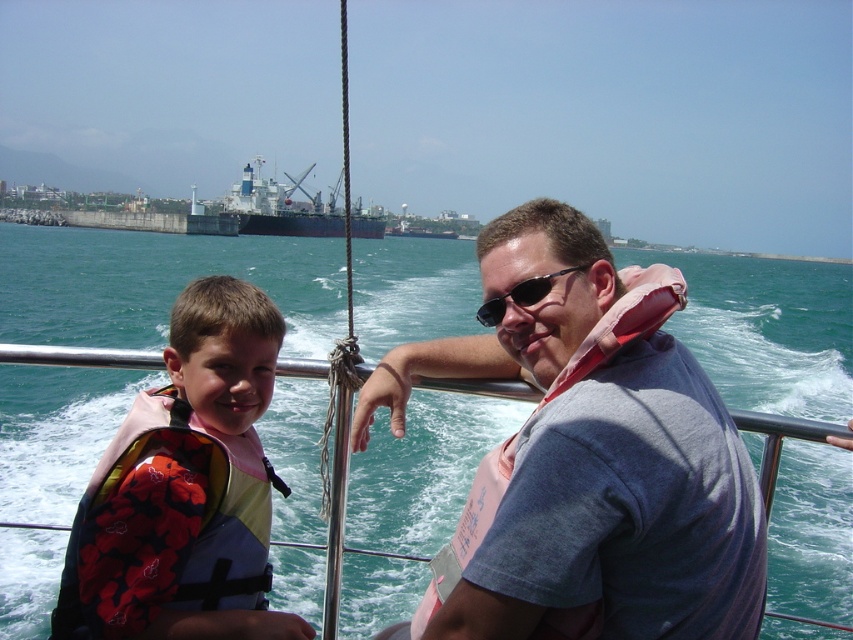
Does gray fabric life vest at right have a larger size compared to dark blue matte ship at center?

No, gray fabric life vest at right is not bigger than dark blue matte ship at center.

Does gray fabric life vest at right have a lesser height compared to dark blue matte ship at center?

Yes.

Find the location of a particular element. The width and height of the screenshot is (853, 640). gray fabric life vest at right is located at coordinates (590, 458).

Is dark blue matte ship at center above sunglasses at center?

Indeed, dark blue matte ship at center is positioned over sunglasses at center.

Between point (265, 204) and point (491, 323), which one is positioned in front?

Point (491, 323) is in front.

Locate an element on the screen. dark blue matte ship at center is located at coordinates (292, 209).

The image size is (853, 640). Describe the element at coordinates (590, 458) in the screenshot. I see `gray fabric life vest at right` at that location.

Does gray fabric life vest at right have a smaller size compared to sunglasses at center?

No, gray fabric life vest at right is not smaller than sunglasses at center.

Who is more distant from viewer, (701, 522) or (546, 291)?

Positioned behind is point (546, 291).

The width and height of the screenshot is (853, 640). In order to click on gray fabric life vest at right in this screenshot , I will do `click(590, 458)`.